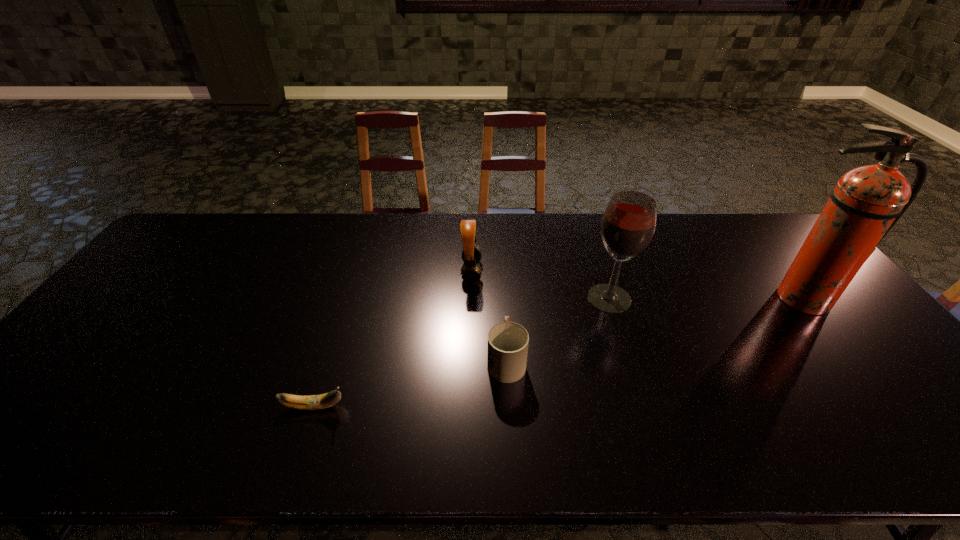
Where is `unoccupied position between the alcohol and the nearest object`? unoccupied position between the alcohol and the nearest object is located at coordinates point(462,353).

At what (x,y) coordinates should I click in order to perform the action: click on free space between the third object from right to left and the alcohol. Please return your answer as a coordinate pair (x, y). This screenshot has height=540, width=960. Looking at the image, I should click on (558, 329).

Identify the location of object that is the second closest one to the fourth object from right to left. (628, 224).

Point out which object is positioned as the nearest to the fourth object from right to left. Please provide its 2D coordinates. Your answer should be formatted as a tuple, i.e. [(x, y)], where the tuple contains the x and y coordinates of a point satisfying the conditions above.

[(508, 342)]

You are a GUI agent. You are given a task and a screenshot of the screen. Output one action in this format:
    pyautogui.click(x=<x>, y=<y>)
    Task: Click on the vacant position in the image that satisfies the following two spatial constraints: 1. on the ear cups of the fourth object from right to left; 2. on the left side of the fourth object from left to right
    The image size is (960, 540).
    Given the screenshot: What is the action you would take?
    pyautogui.click(x=471, y=299)

I want to click on vacant space that satisfies the following two spatial constraints: 1. at the nozzle of the tallest object; 2. at the stem of the leftmost object, so click(886, 407).

Find the location of a particular element. Image resolution: width=960 pixels, height=540 pixels. vacant area in the image that satisfies the following two spatial constraints: 1. on the ear cups of the alcohol; 2. on the right side of the third shortest object is located at coordinates (471, 299).

The image size is (960, 540). I want to click on free space that satisfies the following two spatial constraints: 1. on the ear cups of the second tallest object; 2. on the right side of the headset, so click(471, 299).

At what (x,y) coordinates should I click in order to perform the action: click on vacant space that satisfies the following two spatial constraints: 1. on the side of the third object from right to left where the handle is located; 2. on the ear cups of the third tallest object. Please return your answer as a coordinate pair (x, y). This screenshot has width=960, height=540. Looking at the image, I should click on (501, 271).

Where is `vacant region that satisfies the following two spatial constraints: 1. at the nozzle of the fire extinguisher; 2. at the stem of the banana`? vacant region that satisfies the following two spatial constraints: 1. at the nozzle of the fire extinguisher; 2. at the stem of the banana is located at coordinates (886, 407).